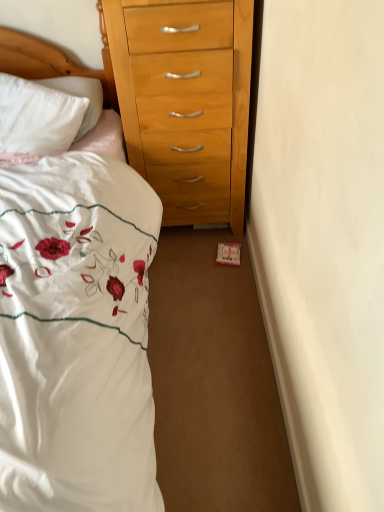
Question: Is white embroidered fabric at left touching wooden headboard at upper left?

Choices:
 (A) yes
 (B) no

Answer: (B)

Question: Does white embroidered fabric at left turn towards wooden headboard at upper left?

Choices:
 (A) yes
 (B) no

Answer: (B)

Question: Is white embroidered fabric at left completely or partially outside of wooden headboard at upper left?

Choices:
 (A) yes
 (B) no

Answer: (A)

Question: Considering the relative sizes of white embroidered fabric at left and wooden headboard at upper left in the image provided, is white embroidered fabric at left thinner than wooden headboard at upper left?

Choices:
 (A) yes
 (B) no

Answer: (B)

Question: Is white embroidered fabric at left smaller than wooden headboard at upper left?

Choices:
 (A) no
 (B) yes

Answer: (A)

Question: Is white embroidered fabric at left bigger than wooden headboard at upper left?

Choices:
 (A) yes
 (B) no

Answer: (A)

Question: Considering the relative sizes of wooden headboard at upper left and white embroidered fabric at left in the image provided, is wooden headboard at upper left wider than white embroidered fabric at left?

Choices:
 (A) no
 (B) yes

Answer: (A)

Question: From a real-world perspective, is wooden headboard at upper left positioned over white embroidered fabric at left based on gravity?

Choices:
 (A) no
 (B) yes

Answer: (B)

Question: Does wooden headboard at upper left have a lesser height compared to white embroidered fabric at left?

Choices:
 (A) no
 (B) yes

Answer: (B)

Question: Is white embroidered fabric at left inside wooden headboard at upper left?

Choices:
 (A) yes
 (B) no

Answer: (B)

Question: From the image's perspective, would you say wooden headboard at upper left is shown under white embroidered fabric at left?

Choices:
 (A) yes
 (B) no

Answer: (B)

Question: Is wooden headboard at upper left turned away from white embroidered fabric at left?

Choices:
 (A) no
 (B) yes

Answer: (B)

Question: Does point (16, 314) appear closer or farther from the camera than point (69, 69)?

Choices:
 (A) farther
 (B) closer

Answer: (B)